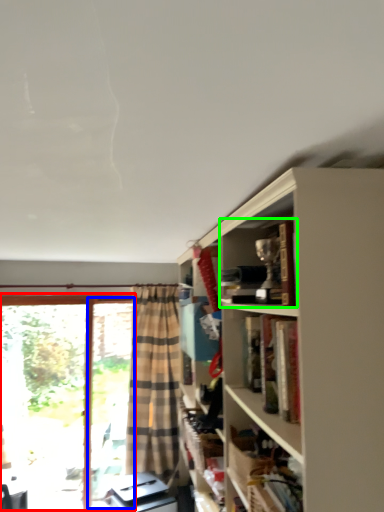
Question: Estimate the real-world distances between objects in this image. Which object is closer to bay window (highlighted by a red box), screen door (highlighted by a blue box) or book (highlighted by a green box)?

Choices:
 (A) screen door
 (B) book

Answer: (A)